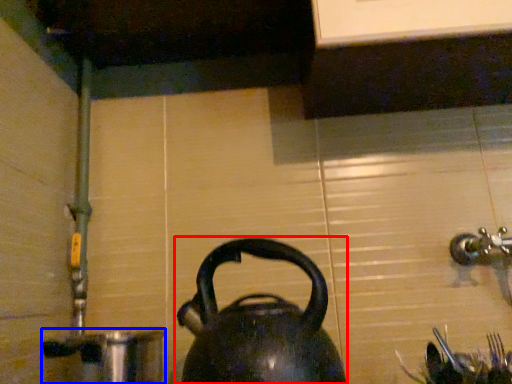
Question: Which object appears closest to the camera in this image, kettle (highlighted by a red box) or coffeepot (highlighted by a blue box)?

Choices:
 (A) kettle
 (B) coffeepot

Answer: (A)